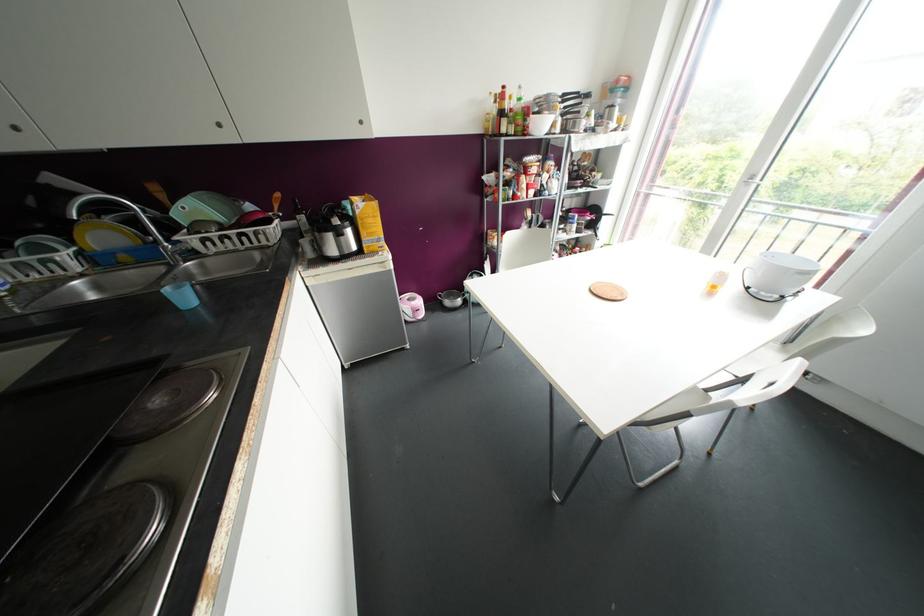
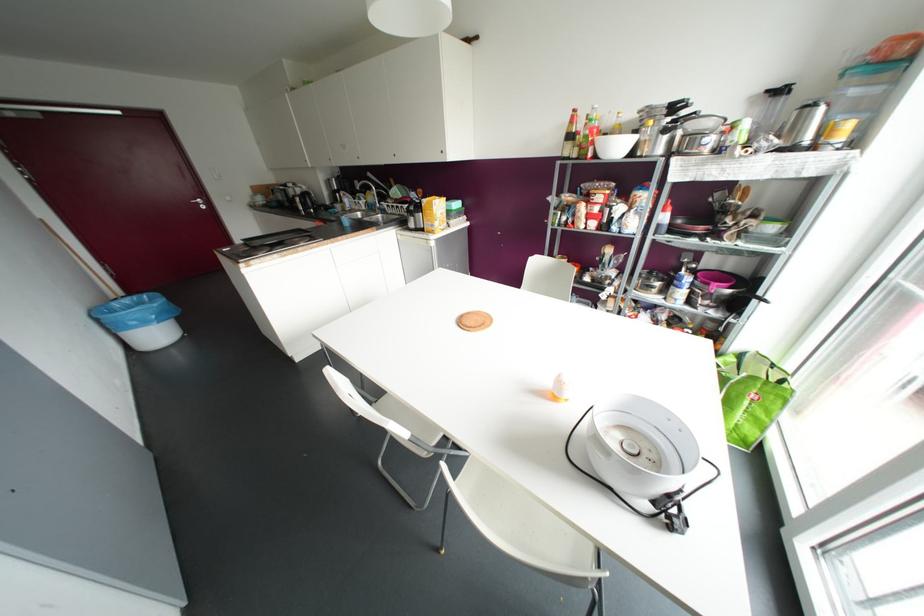
Find the pixel in the second image that matches point (564, 97) in the first image.

(673, 107)